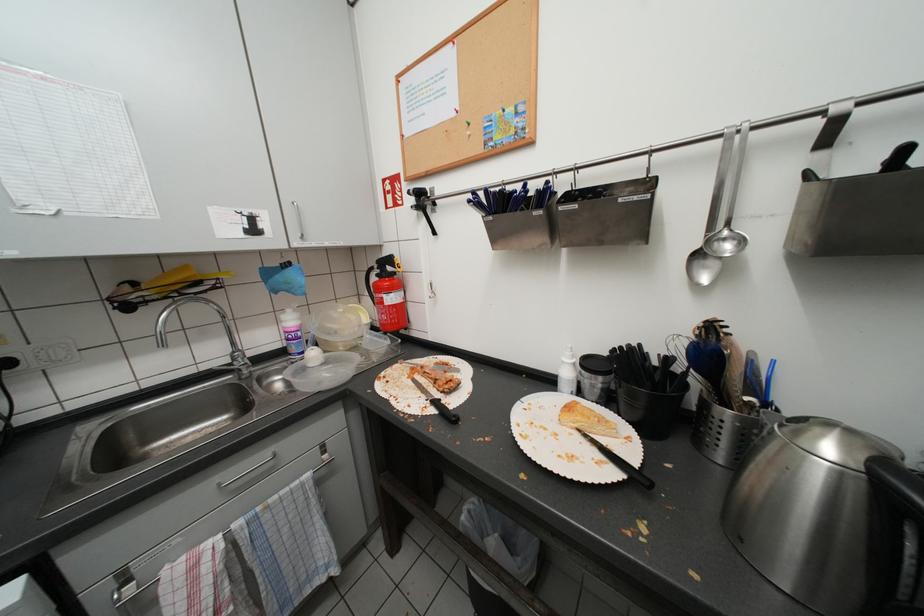
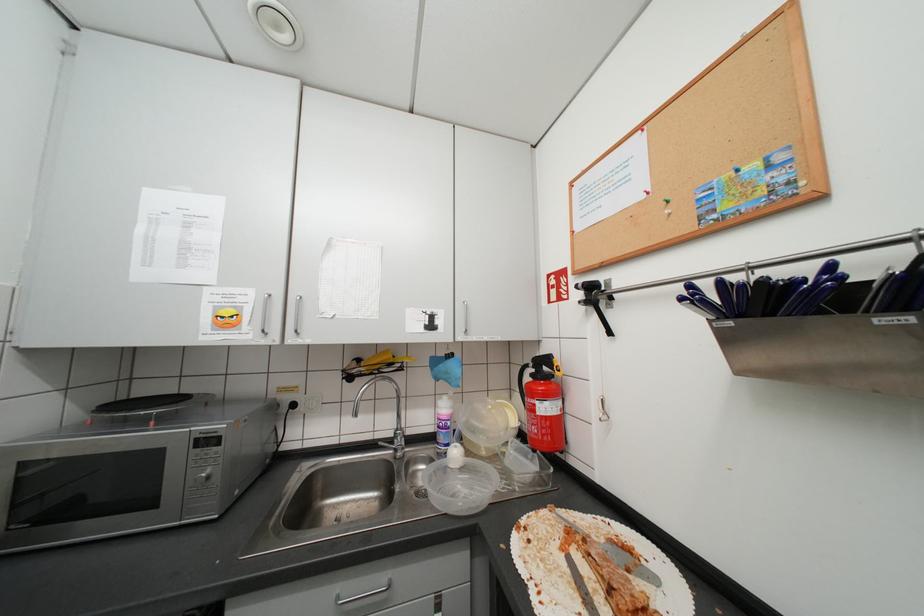
The images are taken continuously from a first-person perspective. In which direction is your viewpoint rotating?

The camera's rotation is toward left-up.